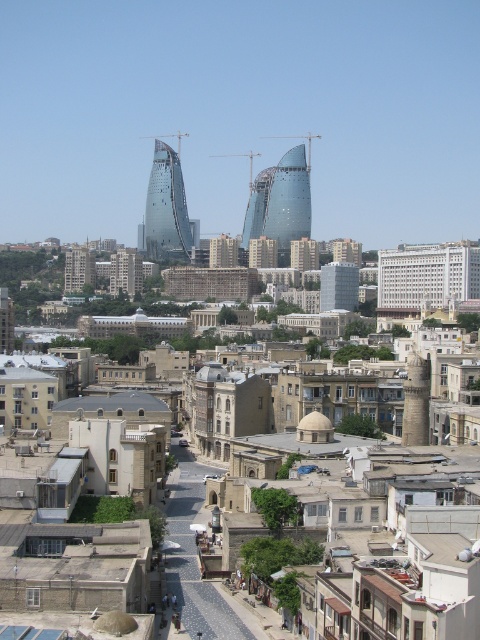
You are an architect analyzing this cityscape. You notice the glassy steel twin towers at center and the matte glass building at center. Which of these two buildings is located to the left when viewed from the street level?

The glassy steel twin towers at center is positioned on the left side of matte glass building at center, so it is located to the left when viewed from the street level.

You are a drone operator tasked with flying a drone between the glassy steel tower at center and the glassy steel twin towers at center. The drone has a maximum flight distance of 200 feet. Can you safely navigate the drone through this gap without exceeding its range?

The distance between the glassy steel tower at center and the glassy steel twin towers at center is 183.58 feet, which is within the drone operator maximum flight distance of 200 feet. Yes, the drone can safely navigate through the gap without exceeding its range.

You are standing at the center of the city square and want to take a photo of the glassy steel tower at center. Which direction should you face to capture it in your shot?

You should face towards the center of the city square to capture the glassy steel tower at center in your shot.